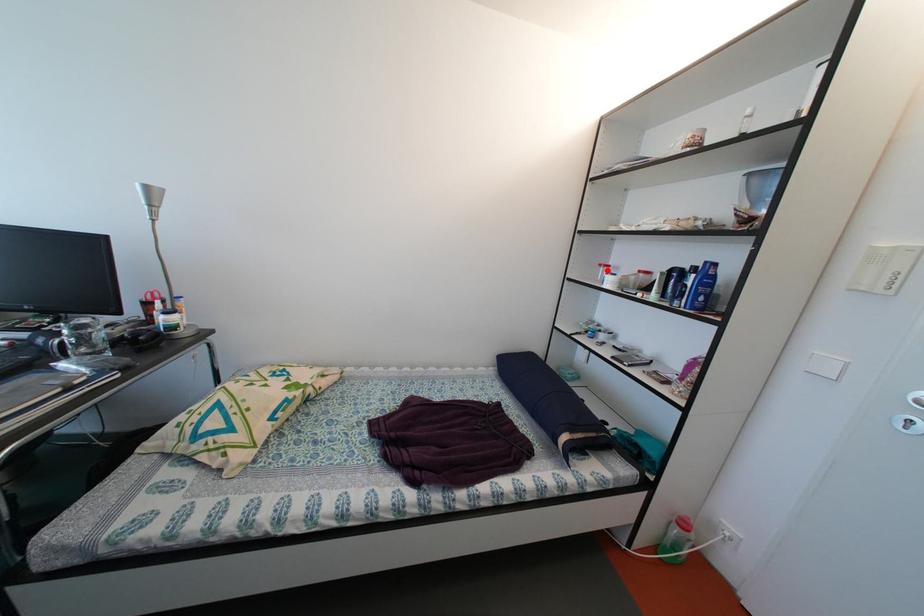
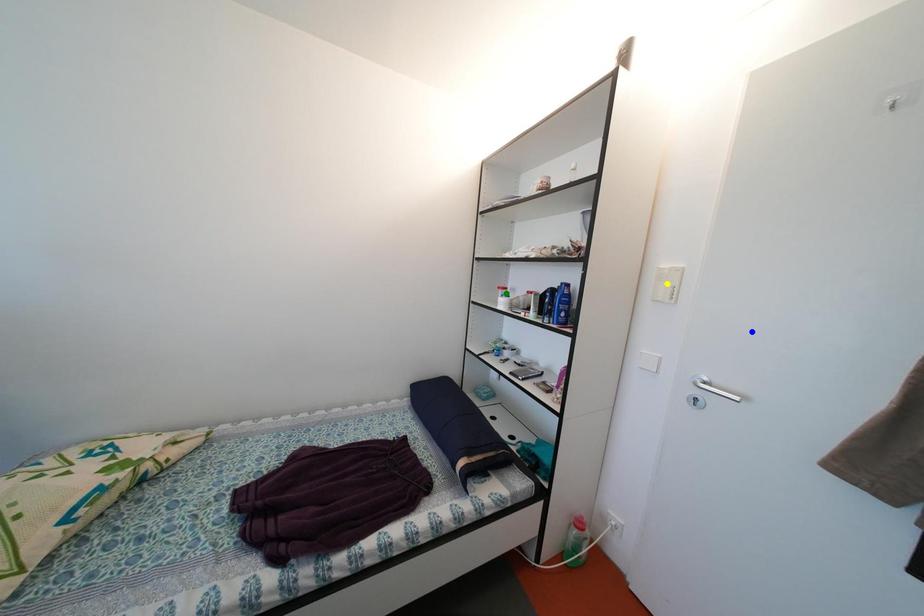
Question: I am providing you with two images of the same scene from different viewpoints. A red point is marked on the first image. You are given multiple points on the second image. Can you choose the point in image 2 that corresponds to the point in image 1?

Choices:
 (A) yellow point
 (B) green point
 (C) blue point

Answer: (B)